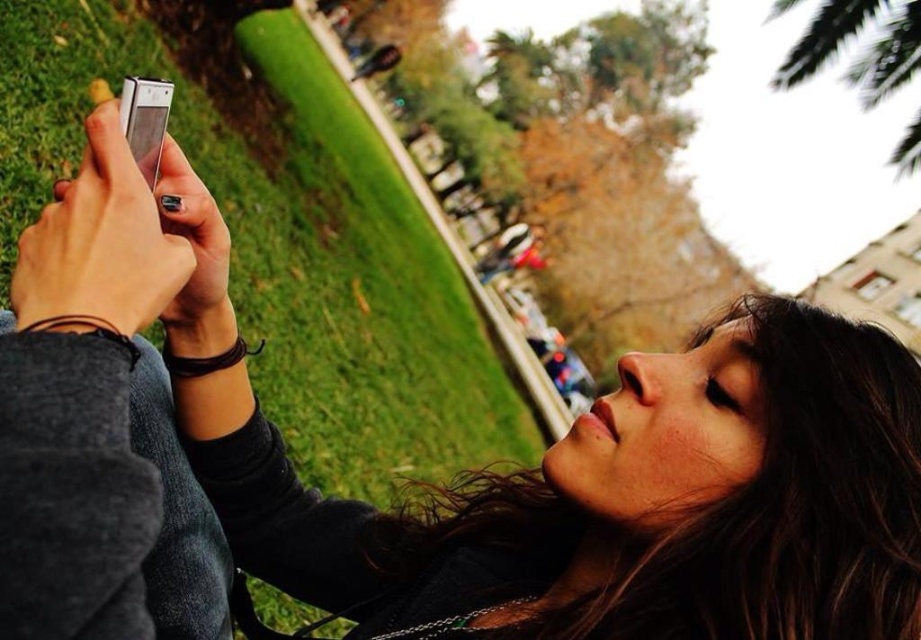
Who is more distant from viewer, [616,596] or [120,92]?

The point [120,92] is behind.

At what (x,y) coordinates should I click in order to perform the action: click on dark brown hair at upper right. Please return your answer as a coordinate pair (x, y). Looking at the image, I should click on (793, 504).

I want to click on dark brown hair at upper right, so click(793, 504).